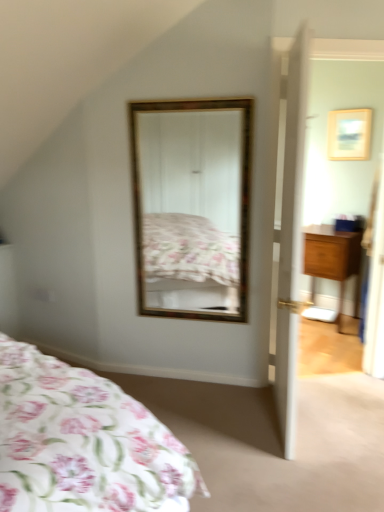
What are the coordinates of `unoccupied region to the right of white wooden door at right` in the screenshot? It's located at click(x=340, y=419).